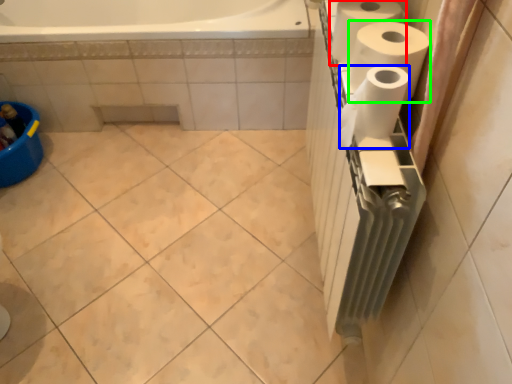
Question: Considering the real-world distances, which object is farthest from paper towel (highlighted by a red box)? paper towel (highlighted by a blue box) or paper towel (highlighted by a green box)?

Choices:
 (A) paper towel
 (B) paper towel

Answer: (A)